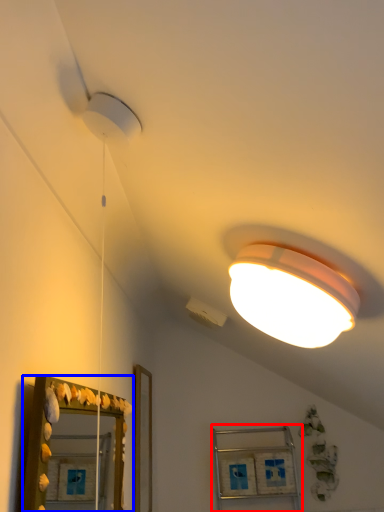
Question: Which object is further to the camera taking this photo, cabinet (highlighted by a red box) or mirror (highlighted by a blue box)?

Choices:
 (A) cabinet
 (B) mirror

Answer: (A)